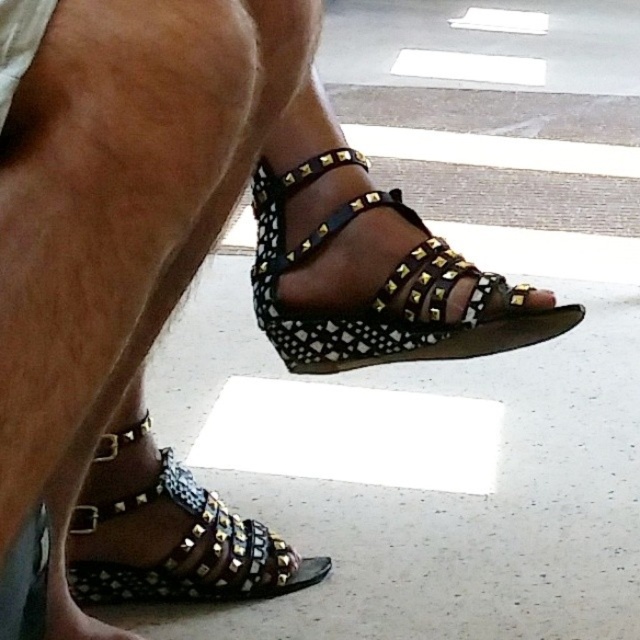
Question: From the image, what is the correct spatial relationship of black studded wedge at center in relation to black studded sandal at lower left?

Choices:
 (A) above
 (B) below

Answer: (A)

Question: Based on their relative distances, which object is farther from the black studded wedge at center?

Choices:
 (A) matte black sandal at center
 (B) black studded sandal at lower left

Answer: (B)

Question: Which point is closer to the camera?

Choices:
 (A) (300, 252)
 (B) (540, 292)

Answer: (B)

Question: Considering the real-world distances, which object is farthest from the black studded sandal at lower left?

Choices:
 (A) matte black sandal at center
 (B) black studded wedge at center

Answer: (A)

Question: Is black studded wedge at center to the left of black studded sandal at lower left from the viewer's perspective?

Choices:
 (A) yes
 (B) no

Answer: (B)

Question: In this image, where is black studded wedge at center located relative to black studded sandal at lower left?

Choices:
 (A) left
 (B) right

Answer: (B)